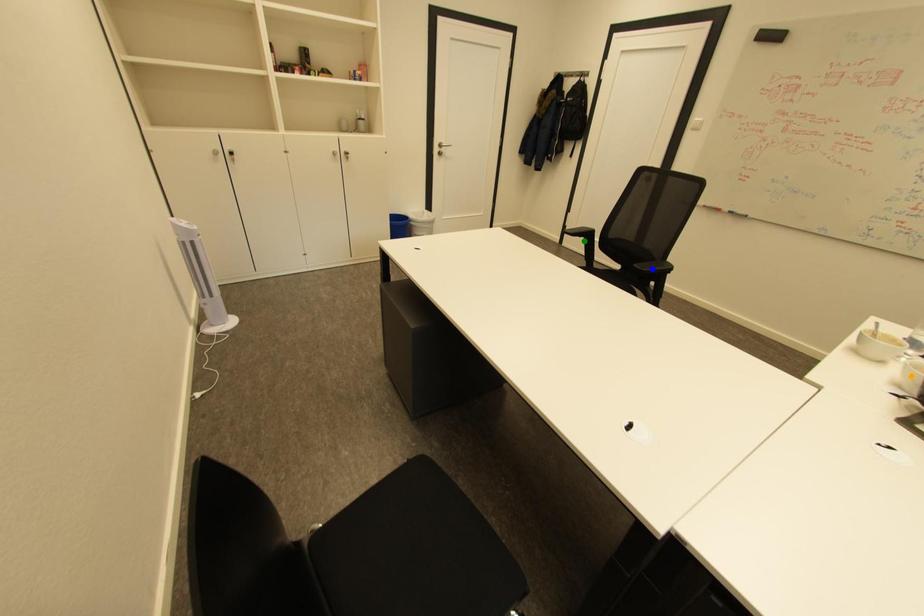
Order these from nearest to farthest:
green point
blue point
orange point

1. orange point
2. blue point
3. green point